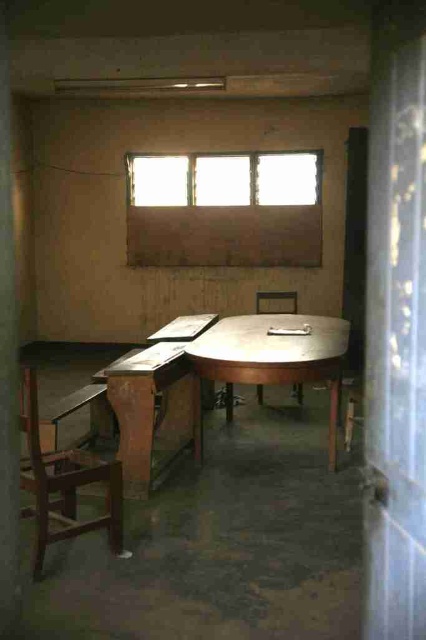
Does metallic polished table at center have a greater width compared to wooden chair at center?

Yes, metallic polished table at center is wider than wooden chair at center.

Between metallic polished table at center and wooden chair at center, which one appears on the right side from the viewer's perspective?

wooden chair at center

Is point (276, 378) more distant than point (284, 298)?

No, it is in front of (284, 298).

I want to click on metallic polished table at center, so click(x=270, y=358).

Measure the distance from matte wooden window at upper center to metallic polished table at center.

matte wooden window at upper center is 3.06 meters away from metallic polished table at center.

Who is positioned more to the left, matte wooden window at upper center or metallic polished table at center?

Positioned to the left is matte wooden window at upper center.

Is point (137, 216) behind point (207, 332)?

That is True.

Where is `matte wooden window at upper center`? The width and height of the screenshot is (426, 640). matte wooden window at upper center is located at coordinates (224, 209).

Who is higher up, matte wooden window at upper center or wooden table at center?

matte wooden window at upper center is above.

Between point (201, 160) and point (132, 468), which one is positioned in front?

Point (132, 468)

Image resolution: width=426 pixels, height=640 pixels. Identify the location of matte wooden window at upper center. (224, 209).